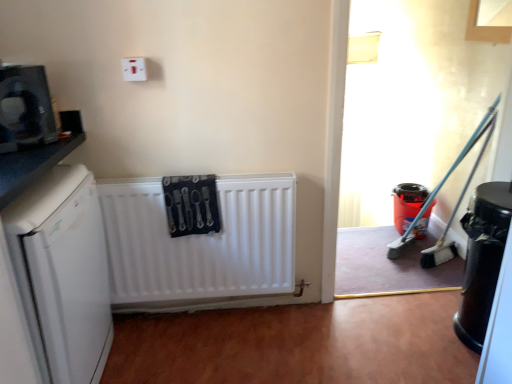
How much space does matte black microwave at upper left, marked as the 3th appliance in a right-to-left arrangement, occupy horizontally?

matte black microwave at upper left, marked as the 3th appliance in a right-to-left arrangement, is 5.28 inches in width.

The height and width of the screenshot is (384, 512). In order to click on matte plastic bucket at right, marked as the first appliance in a right-to-left arrangement in this screenshot , I will do `click(407, 204)`.

What do you see at coordinates (134, 69) in the screenshot? I see `white plastic electric outlet at upper center` at bounding box center [134, 69].

Locate an element on the screen. Image resolution: width=512 pixels, height=384 pixels. white matte radiator at center is located at coordinates (199, 242).

How much distance is there between white matte dishwasher at left and black glossy trash can at lower right, acting as the second appliance starting from the left?

white matte dishwasher at left is 1.53 meters from black glossy trash can at lower right, acting as the second appliance starting from the left.

Would you say white matte dishwasher at left is a long distance from black glossy trash can at lower right, acting as the second appliance starting from the left?

That's right, there is a large distance between white matte dishwasher at left and black glossy trash can at lower right, acting as the second appliance starting from the left.

Is white matte dishwasher at left oriented towards black glossy trash can at lower right, which ranks as the second appliance in front-to-back order?

Yes, white matte dishwasher at left is facing black glossy trash can at lower right, which ranks as the second appliance in front-to-back order.

How different are the orientations of white matte dishwasher at left and black glossy trash can at lower right, the 2th appliance positioned from the right, in degrees?

177 degrees.

Consider the image. From the image's perspective, which is below, matte plastic bucket at right, the first appliance from the back, or white matte dishwasher at left?

From the image's view, white matte dishwasher at left is below.

Between matte plastic bucket at right, marked as the first appliance in a right-to-left arrangement, and white matte dishwasher at left, which one has smaller size?

Smaller between the two is matte plastic bucket at right, marked as the first appliance in a right-to-left arrangement.

How much distance is there between matte plastic bucket at right, acting as the third appliance starting from the front, and white matte dishwasher at left?

The distance of matte plastic bucket at right, acting as the third appliance starting from the front, from white matte dishwasher at left is 1.95 meters.

Between matte plastic bucket at right, the first appliance from the back, and white matte dishwasher at left, which one has less height?

matte plastic bucket at right, the first appliance from the back, is shorter.

Is white matte dishwasher at left beside white matte radiator at center?

white matte dishwasher at left and white matte radiator at center are clearly separated.

From the image's perspective, does white matte dishwasher at left appear higher than white matte radiator at center?

Actually, white matte dishwasher at left appears below white matte radiator at center in the image.

Locate an element on the screen. This screenshot has width=512, height=384. radiator that appears below the white matte dishwasher at left (from a real-world perspective) is located at coordinates (199, 242).

Is black glossy trash can at lower right, the 2th appliance positioned from the right, with white plastic electric outlet at upper center?

No, black glossy trash can at lower right, the 2th appliance positioned from the right, is not with white plastic electric outlet at upper center.

Is black glossy trash can at lower right, acting as the second appliance starting from the left, oriented towards white plastic electric outlet at upper center?

Yes, black glossy trash can at lower right, acting as the second appliance starting from the left, is aimed at white plastic electric outlet at upper center.

From a real-world perspective, is black glossy trash can at lower right, the 2th appliance positioned from the right, on white plastic electric outlet at upper center?

Incorrect, from a real-world perspective, black glossy trash can at lower right, the 2th appliance positioned from the right, is lower than white plastic electric outlet at upper center.

Considering the relative sizes of black glossy trash can at lower right, the second appliance when ordered from back to front, and white plastic electric outlet at upper center in the image provided, is black glossy trash can at lower right, the second appliance when ordered from back to front, taller than white plastic electric outlet at upper center?

Indeed, black glossy trash can at lower right, the second appliance when ordered from back to front, has a greater height compared to white plastic electric outlet at upper center.

Considering the relative sizes of white plastic electric outlet at upper center and black glossy trash can at lower right, the 2th appliance positioned from the right, in the image provided, is white plastic electric outlet at upper center shorter than black glossy trash can at lower right, the 2th appliance positioned from the right,?

Correct, white plastic electric outlet at upper center is not as tall as black glossy trash can at lower right, the 2th appliance positioned from the right.

Which object is positioned more to the left, white plastic electric outlet at upper center or black glossy trash can at lower right, which ranks as the second appliance in front-to-back order?

From the viewer's perspective, white plastic electric outlet at upper center appears more on the left side.

Is white plastic electric outlet at upper center next to black glossy trash can at lower right, which ranks as the second appliance in front-to-back order, and touching it?

white plastic electric outlet at upper center is not next to black glossy trash can at lower right, which ranks as the second appliance in front-to-back order, and they're not touching.

Which is behind, point (138, 67) or point (489, 315)?

The point (138, 67) is farther.

Considering the relative sizes of white matte radiator at center and matte black microwave at upper left, the third appliance from the back, in the image provided, is white matte radiator at center taller than matte black microwave at upper left, the third appliance from the back,?

Correct, white matte radiator at center is much taller as matte black microwave at upper left, the third appliance from the back.

Does white matte radiator at center have a greater width compared to matte black microwave at upper left, the first appliance when ordered from front to back?

In fact, white matte radiator at center might be narrower than matte black microwave at upper left, the first appliance when ordered from front to back.

Which object is further away from the camera taking this photo, white matte radiator at center or matte black microwave at upper left, which is the first appliance in left-to-right order?

white matte radiator at center is behind.

Which object is positioned more to the left, white matte radiator at center or matte black microwave at upper left, the third appliance from the back?

matte black microwave at upper left, the third appliance from the back.

Which of these two, white plastic electric outlet at upper center or matte black microwave at upper left, the first appliance when ordered from front to back, is smaller?

white plastic electric outlet at upper center is smaller.

Can you confirm if white plastic electric outlet at upper center is positioned to the left of matte black microwave at upper left, the third appliance from the back?

In fact, white plastic electric outlet at upper center is to the right of matte black microwave at upper left, the third appliance from the back.

Identify the location of electric outlet above the matte black microwave at upper left, the first appliance when ordered from front to back (from the image's perspective). The image size is (512, 384). (134, 69).

Find the location of a particular element. The image size is (512, 384). the 1st appliance directly beneath the white matte dishwasher at left (from a real-world perspective) is located at coordinates (482, 259).

Locate an element on the screen. The image size is (512, 384). the 1st appliance above the white matte dishwasher at left (from the image's perspective) is located at coordinates tap(407, 204).

When comparing their distances from black glossy trash can at lower right, acting as the second appliance starting from the left, does white plastic electric outlet at upper center or white matte radiator at center seem further?

white plastic electric outlet at upper center lies further to black glossy trash can at lower right, acting as the second appliance starting from the left, than the other object.

Considering their positions, is white matte radiator at center positioned closer to white plastic electric outlet at upper center than matte black microwave at upper left, the third appliance from the back?

matte black microwave at upper left, the third appliance from the back.

In the scene shown: Based on their spatial positions, is white plastic electric outlet at upper center or white matte dishwasher at left further from matte plastic bucket at right, the 3th appliance positioned from the left?

white matte dishwasher at left.

Looking at the image, which one is located further to matte black microwave at upper left, the third appliance from the back, matte plastic bucket at right, the 3th appliance positioned from the left, or white matte dishwasher at left?

Among the two, matte plastic bucket at right, the 3th appliance positioned from the left, is located further to matte black microwave at upper left, the third appliance from the back.

Estimate the real-world distances between objects in this image. Which object is closer to matte plastic bucket at right, the first appliance from the back, black glossy trash can at lower right, the 2th appliance positioned from the right, or white plastic electric outlet at upper center?

black glossy trash can at lower right, the 2th appliance positioned from the right, is positioned closer to the anchor matte plastic bucket at right, the first appliance from the back.

Estimate the real-world distances between objects in this image. Which object is further from black glossy trash can at lower right, acting as the second appliance starting from the left, white matte dishwasher at left or white plastic electric outlet at upper center?

white plastic electric outlet at upper center lies further to black glossy trash can at lower right, acting as the second appliance starting from the left, than the other object.

Estimate the real-world distances between objects in this image. Which object is further from white matte radiator at center, black glossy trash can at lower right, which ranks as the second appliance in front-to-back order, or matte plastic bucket at right, marked as the first appliance in a right-to-left arrangement?

The object further to white matte radiator at center is matte plastic bucket at right, marked as the first appliance in a right-to-left arrangement.

Which object lies further to the anchor point matte plastic bucket at right, marked as the first appliance in a right-to-left arrangement, black glossy trash can at lower right, the 2th appliance positioned from the right, or white matte radiator at center?

The object further to matte plastic bucket at right, marked as the first appliance in a right-to-left arrangement, is white matte radiator at center.

Identify the location of electric outlet situated between white matte dishwasher at left and black glossy trash can at lower right, the 2th appliance positioned from the right, from left to right. This screenshot has height=384, width=512. 134,69.

I want to click on electric outlet between white matte dishwasher at left and matte plastic bucket at right, the 3th appliance positioned from the left, so click(x=134, y=69).

Where is `radiator that lies between white plastic electric outlet at upper center and white matte dishwasher at left from top to bottom`? radiator that lies between white plastic electric outlet at upper center and white matte dishwasher at left from top to bottom is located at coordinates [x=199, y=242].

You are a GUI agent. You are given a task and a screenshot of the screen. Output one action in this format:
    pyautogui.click(x=<x>, y=<y>)
    Task: Click on the radiator between white plastic electric outlet at upper center and matte plastic bucket at right, marked as the first appliance in a right-to-left arrangement, in the horizontal direction
    The width and height of the screenshot is (512, 384).
    Given the screenshot: What is the action you would take?
    pyautogui.click(x=199, y=242)